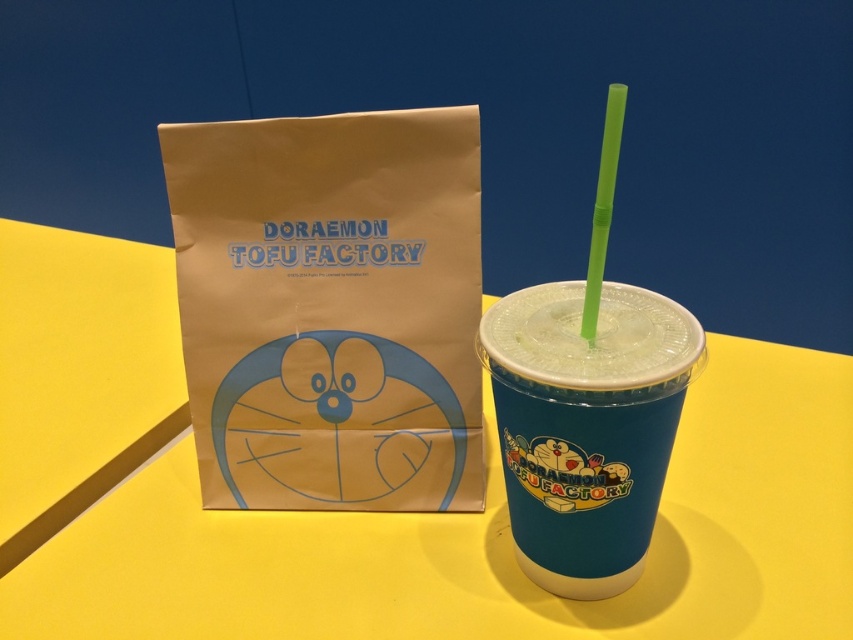
Between yellow matte table at center and brown paper bag at center, which one has more height?

yellow matte table at center

Which is below, yellow matte table at center or brown paper bag at center?

yellow matte table at center is lower down.

The width and height of the screenshot is (853, 640). Identify the location of yellow matte table at center. (383, 513).

At what (x,y) coordinates should I click in order to perform the action: click on yellow matte table at center. Please return your answer as a coordinate pair (x, y). Looking at the image, I should click on (383, 513).

Between blue plastic cup at right and green plastic straw at upper right, which one has less height?

blue plastic cup at right is shorter.

Between point (676, 349) and point (610, 157), which one is positioned behind?

Point (676, 349)

The height and width of the screenshot is (640, 853). Describe the element at coordinates (592, 339) in the screenshot. I see `blue plastic cup at right` at that location.

Locate an element on the screen. blue plastic cup at right is located at coordinates (592, 339).

Which is above, yellow matte table at center or green plastic straw at upper right?

green plastic straw at upper right

Does yellow matte table at center appear on the left side of green plastic straw at upper right?

Yes, yellow matte table at center is to the left of green plastic straw at upper right.

Based on the photo, who is more distant from viewer, (822, 627) or (601, 211)?

The point (822, 627) is more distant.

What are the coordinates of `yellow matte table at center` in the screenshot? It's located at (383, 513).